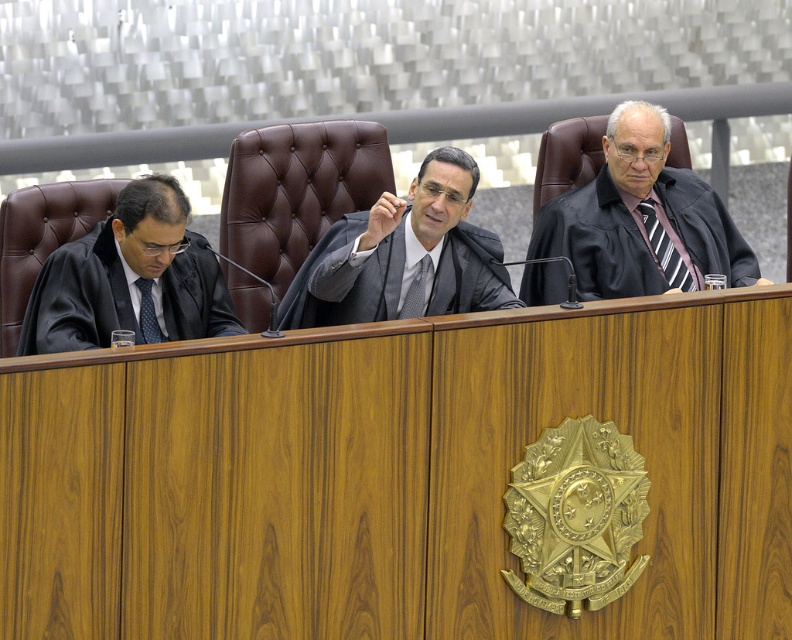
You are standing in front of the wooden panel with the emblem. Where is the matte black robe at center located in terms of its 2D coordinates?

The matte black robe at center is located at the 2D coordinates point (345, 278).

You are an observer in the courtroom. You see a point marked at coordinates (598, 241). What object is located at that point?

The point at coordinates (598, 241) indicates the black fabric robe at center.